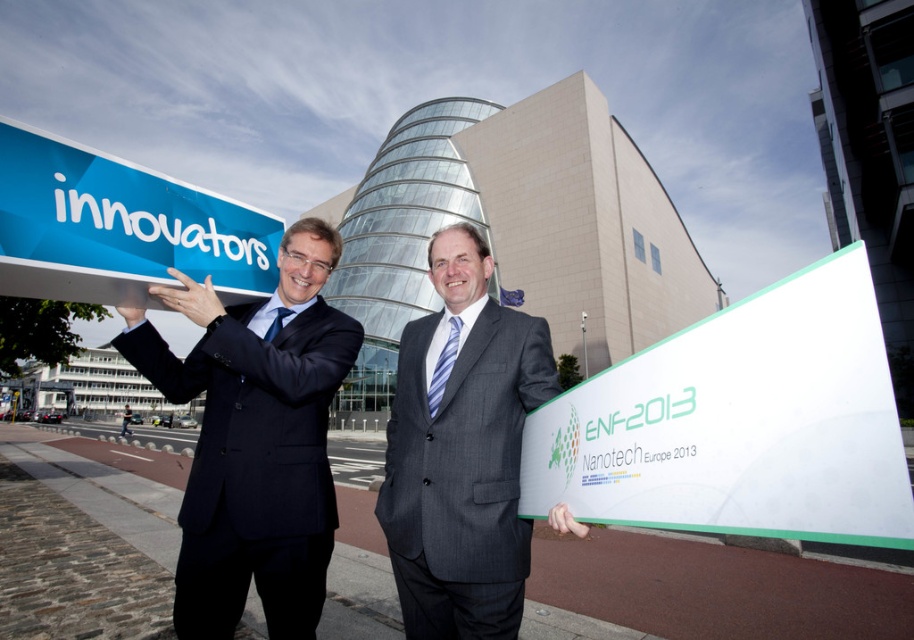
Question: Is dark blue suit at left to the right of gray suit at center from the viewer's perspective?

Choices:
 (A) no
 (B) yes

Answer: (A)

Question: Which point is farther to the camera?

Choices:
 (A) gray suit at center
 (B) white plastic sign at center
 (C) blue plastic sign at upper left

Answer: (A)

Question: Is white plastic sign at center positioned before gray suit at center?

Choices:
 (A) no
 (B) yes

Answer: (B)

Question: Is white plastic sign at center to the left of blue plastic sign at upper left from the viewer's perspective?

Choices:
 (A) yes
 (B) no

Answer: (B)

Question: Which point appears farthest from the camera in this image?

Choices:
 (A) (814, 496)
 (B) (271, 240)
 (C) (278, 296)

Answer: (B)

Question: Among these objects, which one is nearest to the camera?

Choices:
 (A) blue plastic sign at upper left
 (B) white plastic sign at center
 (C) dark blue suit at left
 (D) gray suit at center

Answer: (B)